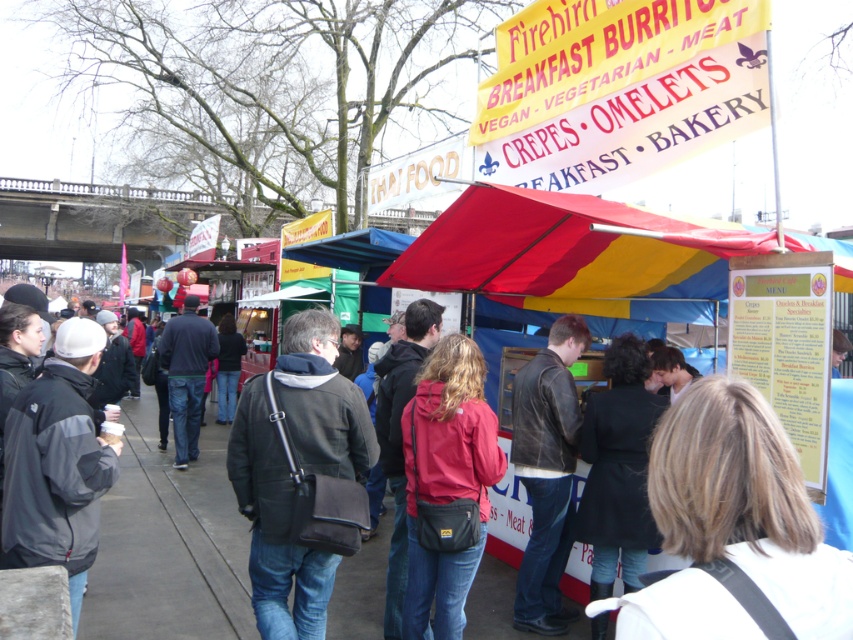
Question: Which is farther from the matte red jacket at center?

Choices:
 (A) dark gray leather jacket at center
 (B) blonde hair at center
 (C) leather jacket at center
 (D) black jacket at left

Answer: (B)

Question: Which is farther from the matte red jacket at center?

Choices:
 (A) black jacket at left
 (B) blonde hair at center

Answer: (B)

Question: Can you confirm if blonde hair at center is wider than dark gray leather jacket at center?

Choices:
 (A) no
 (B) yes

Answer: (A)

Question: Which is nearer to the black jacket at left?

Choices:
 (A) matte red jacket at center
 (B) leather jacket at center
 (C) dark gray leather jacket at center
 (D) dark blue jacket at center

Answer: (C)

Question: Can you confirm if matte red jacket at center is positioned to the right of leather jacket at center?

Choices:
 (A) no
 (B) yes

Answer: (A)

Question: Is blonde hair at center positioned in front of black jacket at left?

Choices:
 (A) no
 (B) yes

Answer: (B)